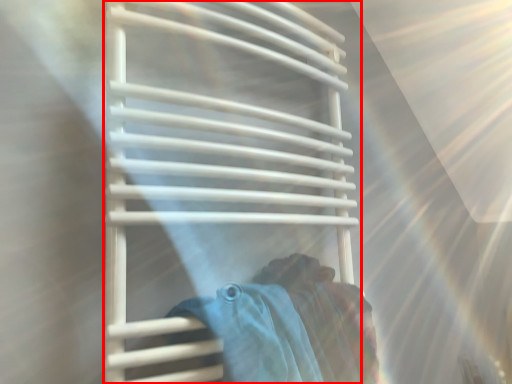
Question: Observing the image, what is the correct spatial positioning of towel rack (annotated by the red box) in reference to woman?

Choices:
 (A) right
 (B) left

Answer: (A)